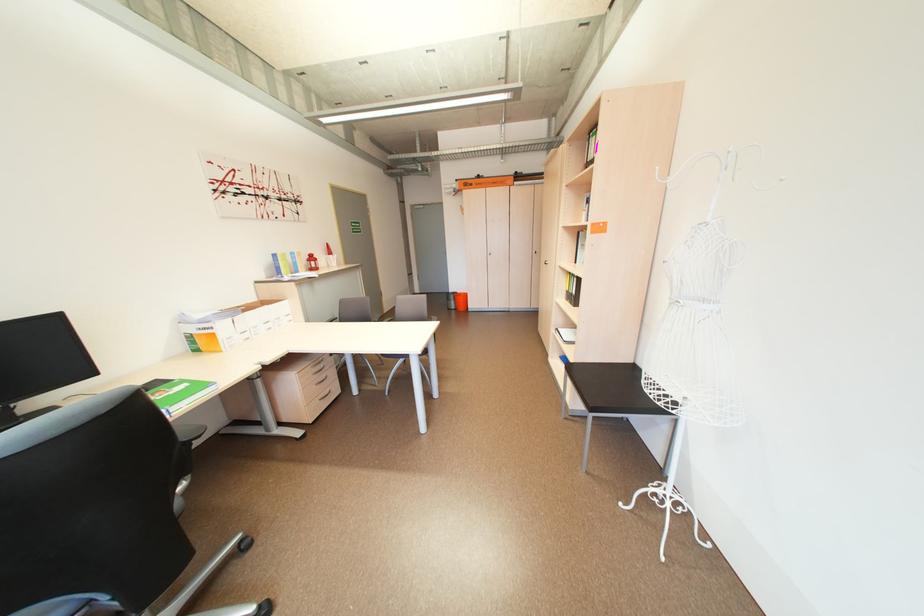
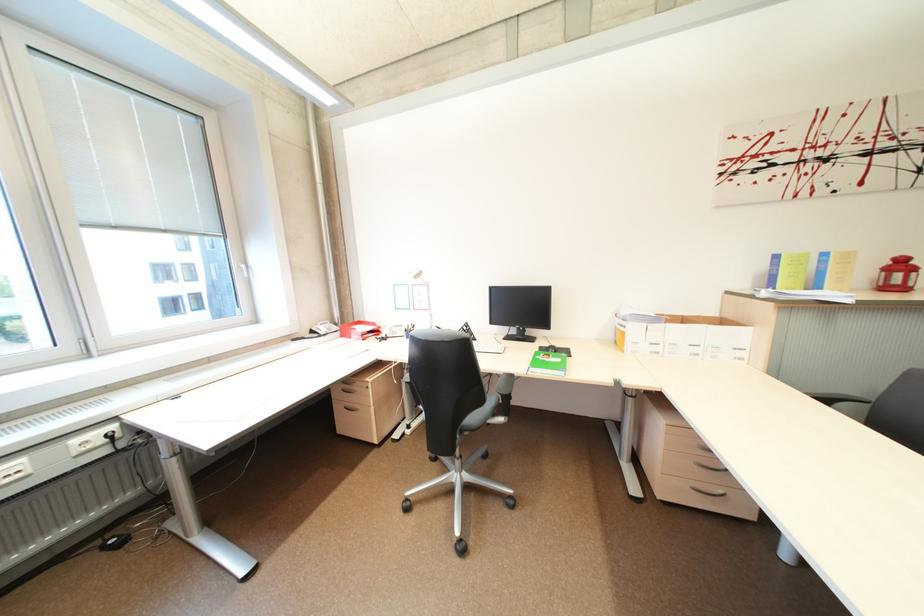
Consider the image. First-person continuous shooting, in which direction is the camera rotating?

The camera's rotation is toward left-down.